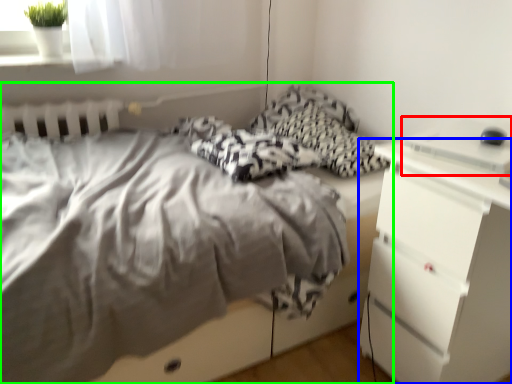
Question: Considering the real-world distances, which object is closest to desktop (highlighted by a red box)? chest of drawers (highlighted by a blue box) or bed (highlighted by a green box).

Choices:
 (A) chest of drawers
 (B) bed

Answer: (A)